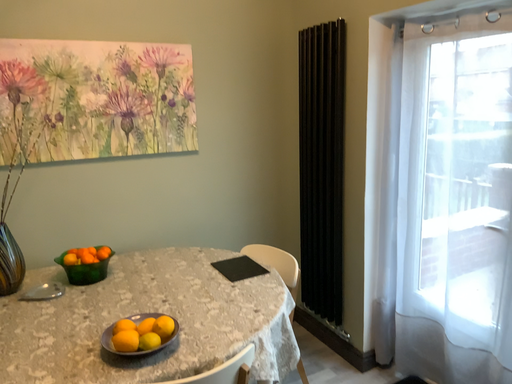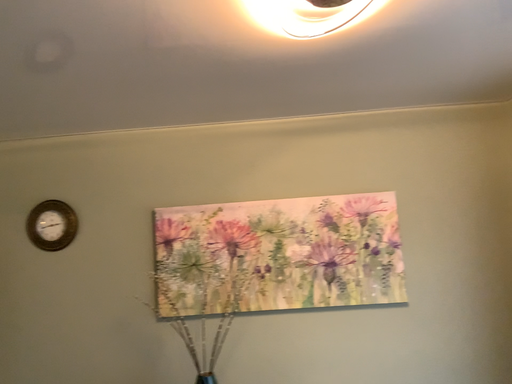
Question: Which way did the camera rotate in the video?

Choices:
 (A) rotated right
 (B) rotated left

Answer: (B)